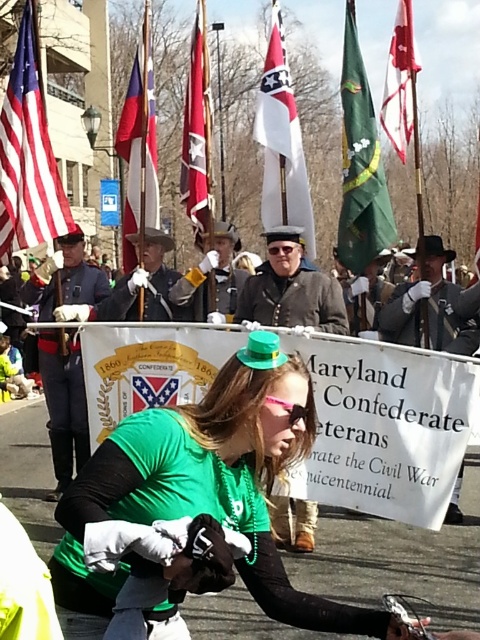
Between white matte flag at center and red fabric flag at upper right, which one is positioned higher?

red fabric flag at upper right is above.

Image resolution: width=480 pixels, height=640 pixels. What are the coordinates of `white matte flag at center` in the screenshot? It's located at (282, 141).

Is shiny blue uniform at center smaller than red fabric flag at center?

Correct, shiny blue uniform at center occupies less space than red fabric flag at center.

Between point (64, 352) and point (476, 220), which one is positioned behind?

Positioned behind is point (476, 220).

Image resolution: width=480 pixels, height=640 pixels. Identify the location of shiny blue uniform at center. (63, 404).

Which of these two, green matte hat at center or matte brown uniform at center, stands shorter?

With less height is matte brown uniform at center.

Is green matte hat at center thinner than matte brown uniform at center?

No, green matte hat at center is not thinner than matte brown uniform at center.

Which is in front, point (109, 618) or point (320, 305)?

Point (109, 618) is more forward.

This screenshot has width=480, height=640. I want to click on green matte hat at center, so click(197, 508).